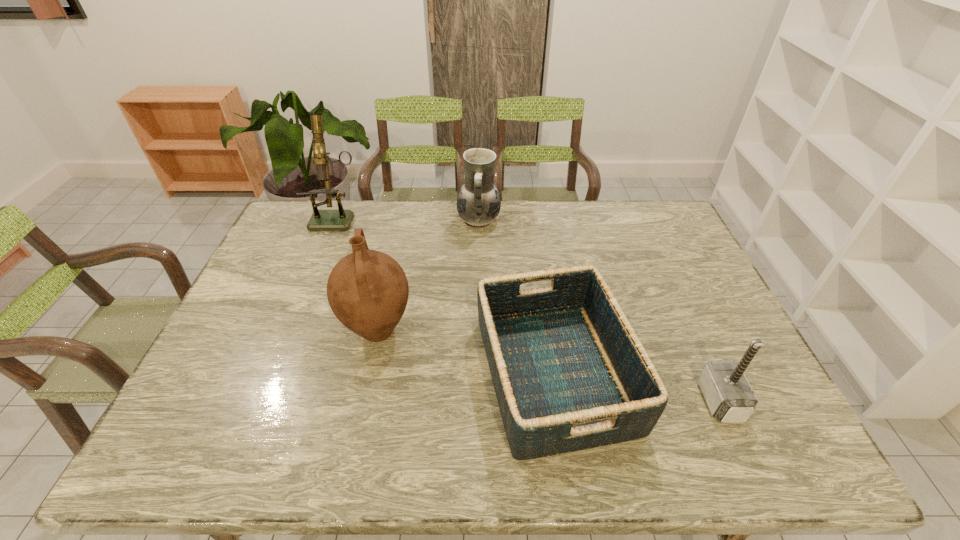
Locate an element on the screen. Image resolution: width=960 pixels, height=540 pixels. object that is the fourth closest to the right pitcher is located at coordinates (729, 396).

Identify which object is the fourth nearest to the microscope. Please provide its 2D coordinates. Your answer should be formatted as a tuple, i.e. [(x, y)], where the tuple contains the x and y coordinates of a point satisfying the conditions above.

[(729, 396)]

Identify the location of vacant region that satisfies the following two spatial constraints: 1. on the front-facing side of the shortest object; 2. on the left side of the farther pitcher. (478, 373).

At what (x,y) coordinates should I click in order to perform the action: click on free region that satisfies the following two spatial constraints: 1. on the front-facing side of the shortest object; 2. on the left side of the right pitcher. Please return your answer as a coordinate pair (x, y). Image resolution: width=960 pixels, height=540 pixels. Looking at the image, I should click on (478, 373).